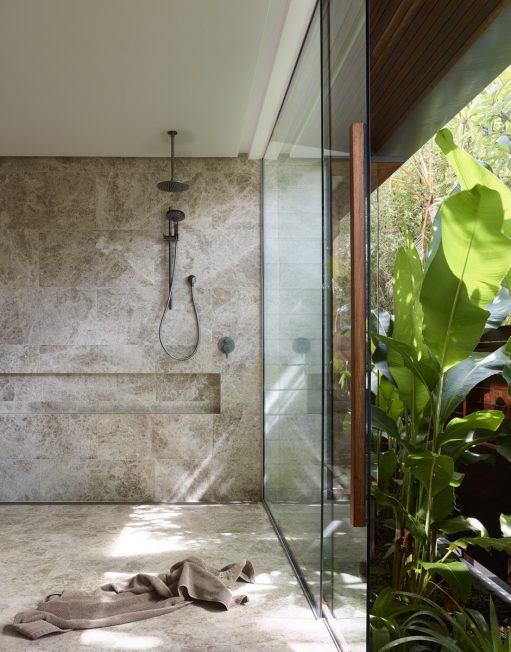
I want to click on recessed part of wall, so click(51, 396).